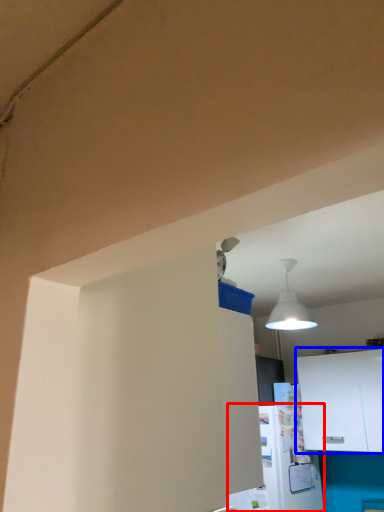
Question: Which object appears closest to the camera in this image, appliance (highlighted by a red box) or cabinetry (highlighted by a blue box)?

Choices:
 (A) appliance
 (B) cabinetry

Answer: (A)